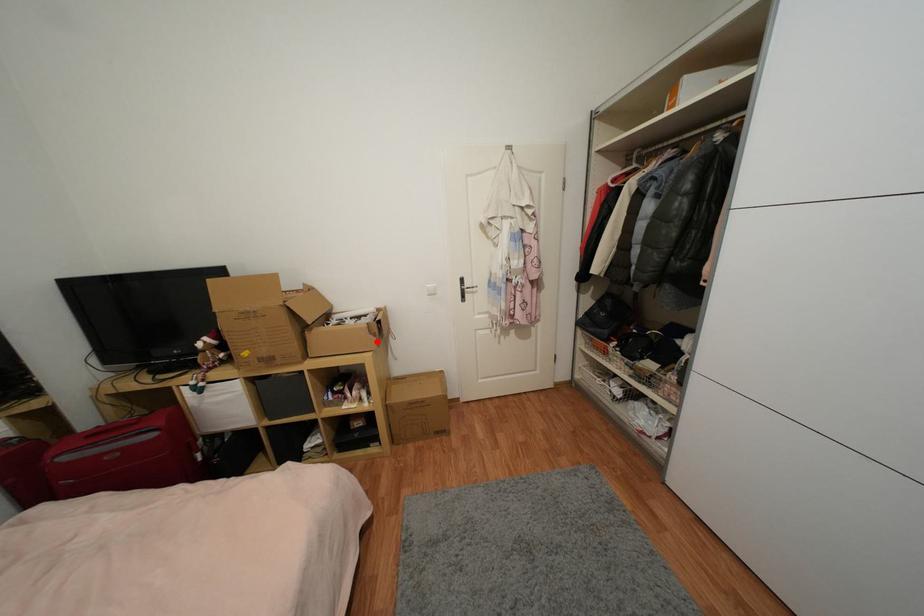
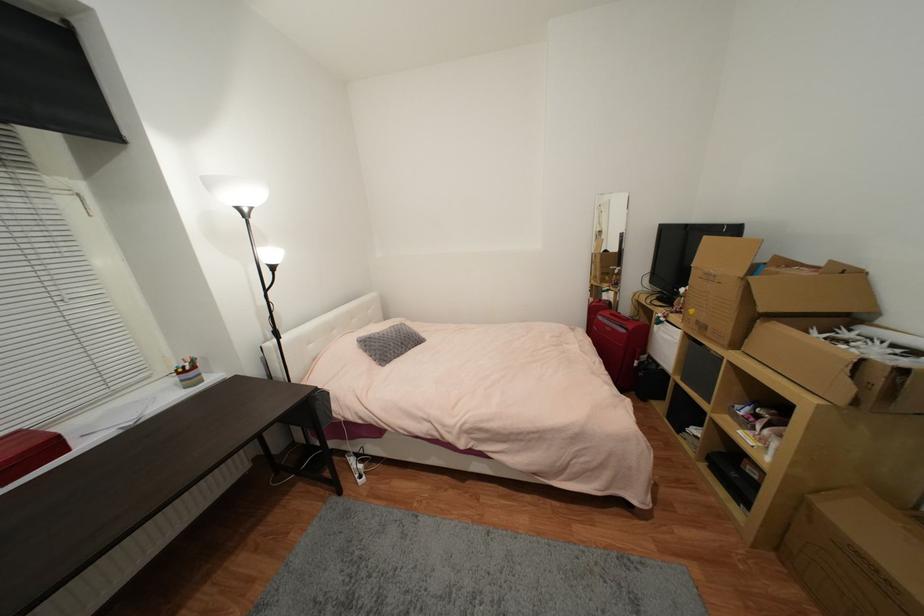
The point at the highlighted location is marked in the first image. Where is the corresponding point in the second image?

(852, 390)